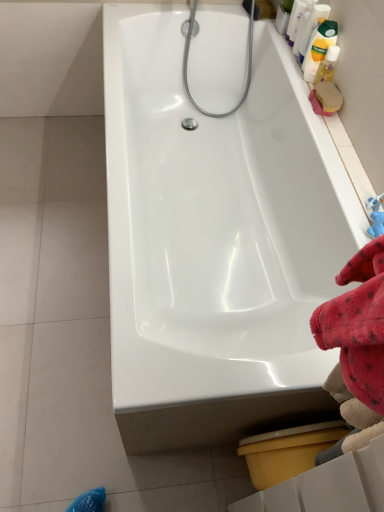
Question: Is yellow matte bottle at upper right, which is the 2th cleaning product in bottom-to-top order, oriented away from white glossy bathtub at center?

Choices:
 (A) yes
 (B) no

Answer: (B)

Question: From a real-world perspective, is yellow matte bottle at upper right, which is the 3th cleaning product in top-to-bottom order, located higher than white glossy bathtub at center?

Choices:
 (A) yes
 (B) no

Answer: (A)

Question: Is white glossy bathtub at center located within yellow matte bottle at upper right, which is the 2th cleaning product in bottom-to-top order?

Choices:
 (A) no
 (B) yes

Answer: (A)

Question: From the image's perspective, is yellow matte bottle at upper right, which is the 2th cleaning product in bottom-to-top order, located beneath white glossy bathtub at center?

Choices:
 (A) no
 (B) yes

Answer: (A)

Question: Does yellow matte bottle at upper right, which is the 2th cleaning product in bottom-to-top order, come in front of white glossy bathtub at center?

Choices:
 (A) no
 (B) yes

Answer: (A)

Question: Can you confirm if yellow matte bottle at upper right, which is the 3th cleaning product in top-to-bottom order, is smaller than white glossy bathtub at center?

Choices:
 (A) yes
 (B) no

Answer: (A)

Question: Can you confirm if yellow plastic toilet bowl at lower right is positioned to the left of white glossy bottle at upper right, marked as the 4th cleaning product in a bottom-to-top arrangement?

Choices:
 (A) no
 (B) yes

Answer: (B)

Question: Considering the relative positions of yellow plastic toilet bowl at lower right and white glossy bottle at upper right, marked as the 4th cleaning product in a bottom-to-top arrangement, in the image provided, is yellow plastic toilet bowl at lower right in front of white glossy bottle at upper right, marked as the 4th cleaning product in a bottom-to-top arrangement,?

Choices:
 (A) yes
 (B) no

Answer: (A)

Question: Is yellow plastic toilet bowl at lower right facing away from white glossy bottle at upper right, the 1th cleaning product viewed from the top?

Choices:
 (A) no
 (B) yes

Answer: (A)

Question: Is yellow plastic toilet bowl at lower right taller than white glossy bottle at upper right, the 1th cleaning product viewed from the top?

Choices:
 (A) no
 (B) yes

Answer: (B)

Question: From the image's perspective, is yellow plastic toilet bowl at lower right on top of white glossy bottle at upper right, the 1th cleaning product viewed from the top?

Choices:
 (A) yes
 (B) no

Answer: (B)

Question: Is yellow plastic toilet bowl at lower right to the right of white glossy bottle at upper right, the 1th cleaning product viewed from the top, from the viewer's perspective?

Choices:
 (A) yes
 (B) no

Answer: (B)

Question: From a real-world perspective, is white glossy bottle at upper right, marked as the 4th cleaning product in a bottom-to-top arrangement, on chrome metallic shower head at upper center?

Choices:
 (A) yes
 (B) no

Answer: (A)